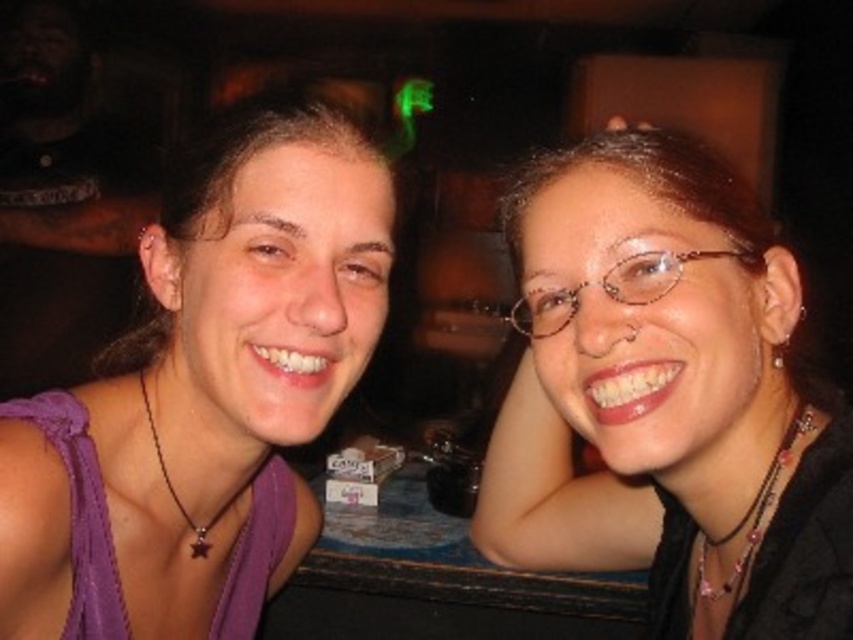
You are sitting at a table in a dimly lit bar. There are two points marked on the table. One is at coordinate point (677, 552) and the other at point (640, 288). If you want to place a small coaster closer to you, which point should you choose?

Point (677, 552) is further to the viewer than point (640, 288), so you should choose point (677, 552) to place the coaster closer to you.

You are at the point labeled point [654,444] and want to move towards the point labeled point [329,212]. Given the scene described, will you be moving towards the background or the foreground of the image?

Since point [654,444] is in front of point [329,212], moving from point [654,444] towards point [329,212] would mean moving towards the background of the image.